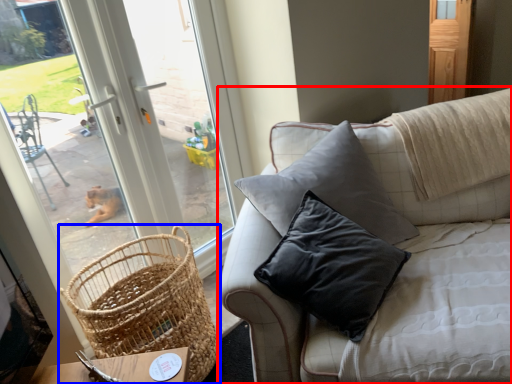
Question: Which object appears closest to the camera in this image, studio couch (highlighted by a red box) or picnic basket (highlighted by a blue box)?

Choices:
 (A) studio couch
 (B) picnic basket

Answer: (A)